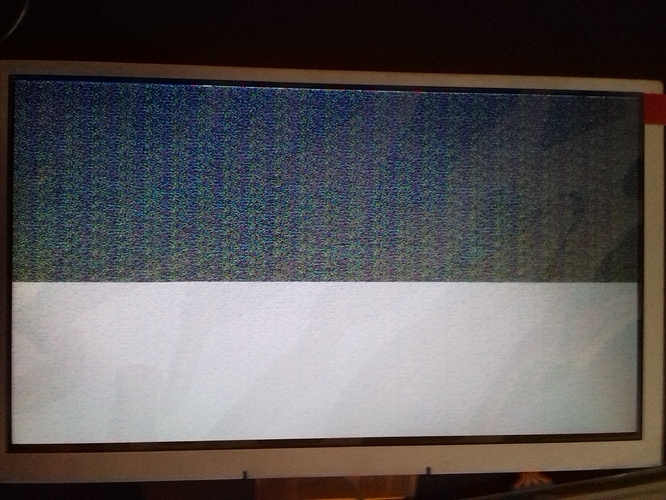
Where is `frame`? Image resolution: width=666 pixels, height=500 pixels. frame is located at coordinates (539, 438).